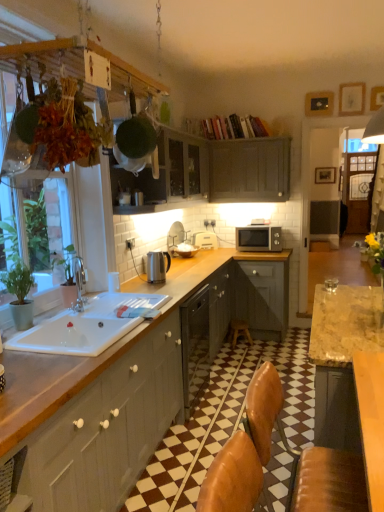
Question: Which direction should I rotate to look at white plastic toaster at upper center, placed as the 1th appliance when sorted from back to front?

Choices:
 (A) left
 (B) right

Answer: (B)

Question: Can you confirm if white ceramic sink at lower left is bigger than wooden stool at center?

Choices:
 (A) yes
 (B) no

Answer: (A)

Question: From a real-world perspective, is white ceramic sink at lower left on wooden stool at center?

Choices:
 (A) yes
 (B) no

Answer: (A)

Question: Considering the relative sizes of white ceramic sink at lower left and wooden stool at center in the image provided, is white ceramic sink at lower left smaller than wooden stool at center?

Choices:
 (A) yes
 (B) no

Answer: (B)

Question: Can you confirm if white ceramic sink at lower left is taller than wooden stool at center?

Choices:
 (A) yes
 (B) no

Answer: (B)

Question: Is white ceramic sink at lower left further to camera compared to wooden stool at center?

Choices:
 (A) yes
 (B) no

Answer: (B)

Question: Can you confirm if white ceramic sink at lower left is wider than wooden stool at center?

Choices:
 (A) no
 (B) yes

Answer: (B)

Question: From a real-world perspective, is matte gray cabinet at left, which is the 3th cabinetry in back-to-front order, below satin silver kettle at counter, the first appliance when ordered from front to back?

Choices:
 (A) no
 (B) yes

Answer: (B)

Question: Considering the relative sizes of matte gray cabinet at left, marked as the third cabinetry in a top-to-bottom arrangement, and satin silver kettle at counter, placed as the 1th appliance when sorted from left to right, in the image provided, is matte gray cabinet at left, marked as the third cabinetry in a top-to-bottom arrangement, taller than satin silver kettle at counter, placed as the 1th appliance when sorted from left to right,?

Choices:
 (A) yes
 (B) no

Answer: (A)

Question: Is matte gray cabinet at left, placed as the first cabinetry when sorted from front to back, closer to camera compared to satin silver kettle at counter, placed as the 1th appliance when sorted from left to right?

Choices:
 (A) yes
 (B) no

Answer: (A)

Question: Does matte gray cabinet at left, which is the 3th cabinetry in back-to-front order, have a larger size compared to satin silver kettle at counter, the 2th appliance when ordered from right to left?

Choices:
 (A) no
 (B) yes

Answer: (B)

Question: Are matte gray cabinet at left, placed as the first cabinetry when sorted from front to back, and satin silver kettle at counter, the first appliance when ordered from front to back, beside each other?

Choices:
 (A) no
 (B) yes

Answer: (A)

Question: Considering the relative positions of matte gray cabinet at left, marked as the 1th cabinetry in a bottom-to-top arrangement, and satin silver kettle at counter, the 2th appliance viewed from the back, in the image provided, is matte gray cabinet at left, marked as the 1th cabinetry in a bottom-to-top arrangement, to the right of satin silver kettle at counter, the 2th appliance viewed from the back, from the viewer's perspective?

Choices:
 (A) yes
 (B) no

Answer: (B)

Question: From a real-world perspective, is white plastic toaster at upper center, which is the 1th appliance in top-to-bottom order, below matte gray cabinet at upper center, placed as the 2th cabinetry when sorted from bottom to top?

Choices:
 (A) no
 (B) yes

Answer: (B)